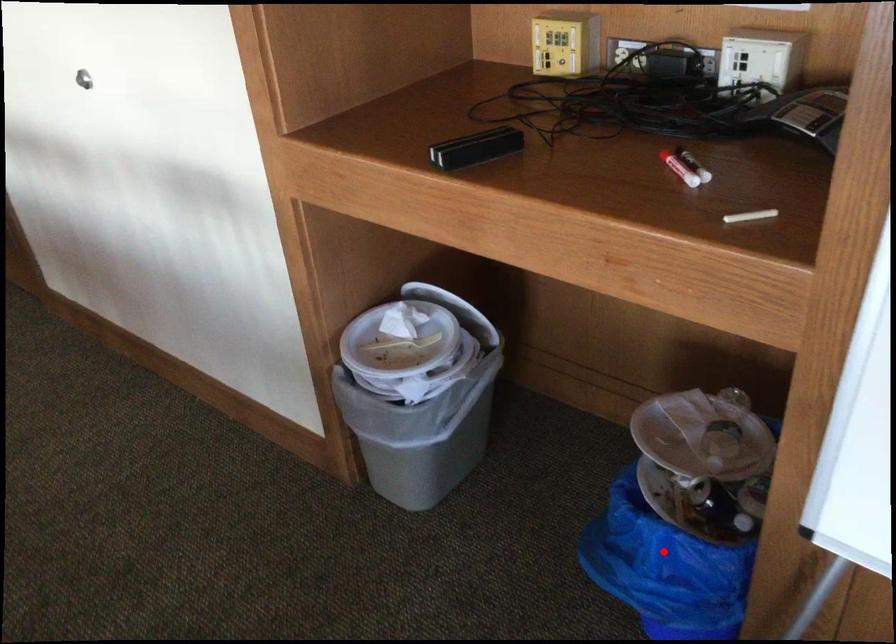
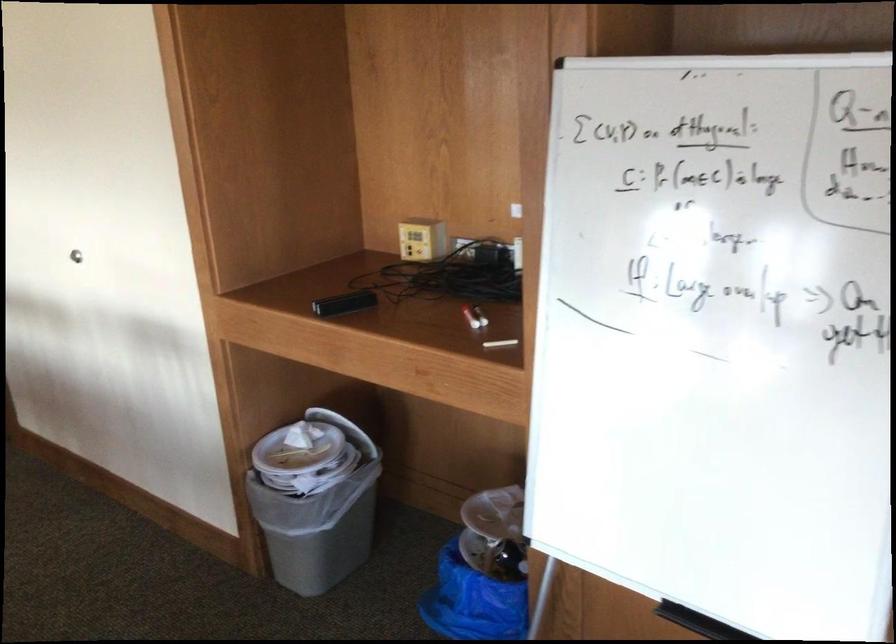
Question: I am providing you with two images of the same scene from different viewpoints. Given a red point in image1, look at the same physical point in image2. Is it:

Choices:
 (A) Closer to the viewpoint
 (B) Farther from the viewpoint

Answer: (B)